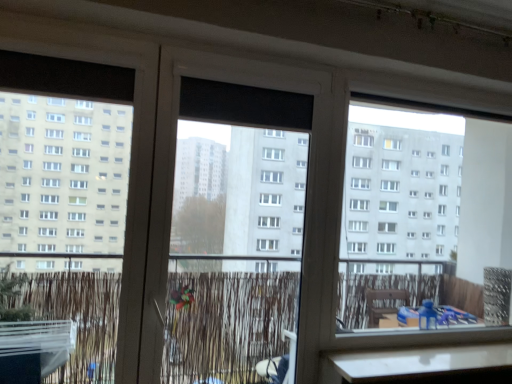
Question: Does transparent plastic screen door at center appear on the left side of black matte window screen at center?

Choices:
 (A) no
 (B) yes

Answer: (B)

Question: Are transparent plastic screen door at center and black matte window screen at center located far from each other?

Choices:
 (A) no
 (B) yes

Answer: (A)

Question: From a real-world perspective, is transparent plastic screen door at center physically below black matte window screen at center?

Choices:
 (A) yes
 (B) no

Answer: (A)

Question: Can you confirm if transparent plastic screen door at center is taller than black matte window screen at center?

Choices:
 (A) no
 (B) yes

Answer: (B)

Question: Can you confirm if transparent plastic screen door at center is shorter than black matte window screen at center?

Choices:
 (A) yes
 (B) no

Answer: (B)

Question: From the image's perspective, does transparent plastic screen door at center appear higher than black matte window screen at center?

Choices:
 (A) yes
 (B) no

Answer: (B)

Question: Does black matte window screen at center have a larger size compared to transparent plastic screen door at center?

Choices:
 (A) no
 (B) yes

Answer: (A)

Question: Is black matte window screen at center positioned behind transparent plastic screen door at center?

Choices:
 (A) no
 (B) yes

Answer: (B)

Question: Can you confirm if black matte window screen at center is shorter than transparent plastic screen door at center?

Choices:
 (A) yes
 (B) no

Answer: (A)

Question: From the image's perspective, is black matte window screen at center above transparent plastic screen door at center?

Choices:
 (A) no
 (B) yes

Answer: (B)

Question: Is the depth of black matte window screen at center less than that of transparent plastic screen door at center?

Choices:
 (A) no
 (B) yes

Answer: (A)

Question: From a real-world perspective, does black matte window screen at center stand above transparent plastic screen door at center?

Choices:
 (A) yes
 (B) no

Answer: (A)

Question: Is black matte window screen at center in front of or behind transparent plastic screen door at center in the image?

Choices:
 (A) behind
 (B) front

Answer: (A)